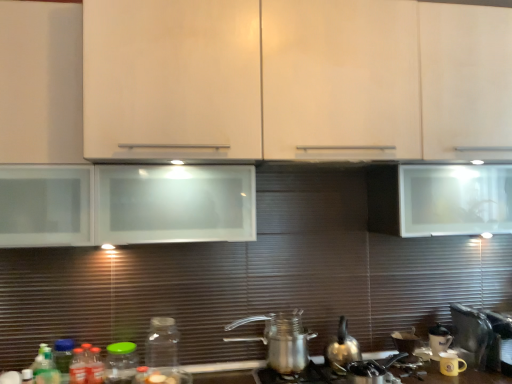
Question: Looking at their shapes, would you say transparent glass jar at lower center, acting as the fifth bottle starting from the left, is wider or thinner than white glossy coffee cup at lower right, acting as the 2th appliance starting from the right?

Choices:
 (A) wide
 (B) thin

Answer: (A)

Question: From their relative heights in the image, would you say transparent glass jar at lower center, the 1th bottle viewed from the right, is taller or shorter than white glossy coffee cup at lower right, which is the second appliance from left to right?

Choices:
 (A) short
 (B) tall

Answer: (B)

Question: Which of these objects is positioned closest to the green matte jar at lower left, marked as the first bottle in a left-to-right arrangement?

Choices:
 (A) green glass jar at lower left, which appears as the 2th bottle when viewed from the right
 (B) transparent glass jar at lower center, acting as the fifth bottle starting from the left
 (C) green matte bottle at lower left, which appears as the 4th bottle when viewed from the right
 (D) translucent plastic bottle at lower left, positioned as the 3th bottle in right-to-left order
 (E) matte white cabinet at center

Answer: (C)

Question: Which of these objects is positioned farthest from the transparent glass jar at lower center, the 1th bottle viewed from the right?

Choices:
 (A) green glass jar at lower left, which appears as the 2th bottle when viewed from the right
 (B) matte white cabinet at center
 (C) metallic silver coffee pot at center
 (D) yellow matte mug at lower right, the 3th appliance positioned from the right
 (E) white glossy coffee cup at lower right, acting as the 2th appliance starting from the right

Answer: (D)